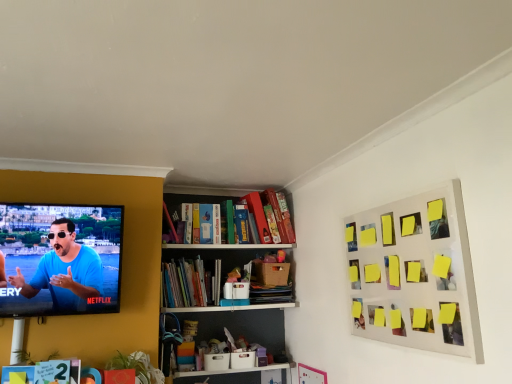
The height and width of the screenshot is (384, 512). Describe the element at coordinates (190, 283) in the screenshot. I see `hardcover books at center, which appears as the second book when viewed from the front` at that location.

What do you see at coordinates (47, 372) in the screenshot? I see `hardcover book at lower left, which ranks as the 2th book in right-to-left order` at bounding box center [47, 372].

The image size is (512, 384). In order to click on matte blue shirt at left in this screenshot , I will do `click(65, 270)`.

Find the location of a particular element. The height and width of the screenshot is (384, 512). picture frame above the hardcover books at center, which appears as the second book when viewed from the front (from the image's perspective) is located at coordinates (x=415, y=274).

How many degrees apart are the facing directions of yellow sticky notes at upper right and hardcover books at center, the second book in the left-to-right sequence?

The angular difference between yellow sticky notes at upper right and hardcover books at center, the second book in the left-to-right sequence, is 90 degrees.

Could you measure the distance between yellow sticky notes at upper right and hardcover books at center, the second book in the left-to-right sequence?

yellow sticky notes at upper right is 1.25 meters away from hardcover books at center, the second book in the left-to-right sequence.

Could you tell me if yellow sticky notes at upper right is turned towards hardcover books at center, which appears as the second book when viewed from the front?

No, yellow sticky notes at upper right does not turn towards hardcover books at center, which appears as the second book when viewed from the front.

Is point (209, 288) in front of point (401, 213)?

No, (209, 288) is behind (401, 213).

Considering the relative sizes of hardcover books at center, positioned as the first book in back-to-front order, and yellow sticky notes at upper right in the image provided, is hardcover books at center, positioned as the first book in back-to-front order, taller than yellow sticky notes at upper right?

No, hardcover books at center, positioned as the first book in back-to-front order, is not taller than yellow sticky notes at upper right.

From the image's perspective, is hardcover books at center, which is the first book from right to left, below yellow sticky notes at upper right?

Indeed, from the image's perspective, hardcover books at center, which is the first book from right to left, is shown beneath yellow sticky notes at upper right.

Is hardcover book at lower left, marked as the second book in a back-to-front arrangement, wider or thinner than matte blue shirt at left?

hardcover book at lower left, marked as the second book in a back-to-front arrangement, is thinner than matte blue shirt at left.

Are hardcover book at lower left, the first book in the front-to-back sequence, and matte blue shirt at left located far from each other?

Actually, hardcover book at lower left, the first book in the front-to-back sequence, and matte blue shirt at left are a little close together.

From the image's perspective, which one is positioned higher, hardcover book at lower left, the 2th book when ordered from top to bottom, or matte blue shirt at left?

matte blue shirt at left, from the image's perspective.

Where is `person above the hardcover book at lower left, which is the first book in bottom-to-top order (from a real-world perspective)`? person above the hardcover book at lower left, which is the first book in bottom-to-top order (from a real-world perspective) is located at coordinates (65, 270).

Does hardcover books at center, the second book in the left-to-right sequence, have a greater height compared to matte blue shirt at left?

No, hardcover books at center, the second book in the left-to-right sequence, is not taller than matte blue shirt at left.

Can you confirm if hardcover books at center, positioned as the first book in back-to-front order, is thinner than matte blue shirt at left?

In fact, hardcover books at center, positioned as the first book in back-to-front order, might be wider than matte blue shirt at left.

Between hardcover books at center, positioned as the 2th book in bottom-to-top order, and matte blue shirt at left, which one appears on the right side from the viewer's perspective?

From the viewer's perspective, hardcover books at center, positioned as the 2th book in bottom-to-top order, appears more on the right side.

Which is behind, hardcover books at center, positioned as the first book in back-to-front order, or matte blue shirt at left?

hardcover books at center, positioned as the first book in back-to-front order, is further away from the camera.

Would you say hardcover books at center, positioned as the first book in back-to-front order, is inside or outside hardcover book at lower left, which is the first book in bottom-to-top order?

hardcover books at center, positioned as the first book in back-to-front order, is not enclosed by hardcover book at lower left, which is the first book in bottom-to-top order.

From the image's perspective, between hardcover books at center, the 1th book in the top-to-bottom sequence, and hardcover book at lower left, which is the first book in bottom-to-top order, who is located below?

hardcover book at lower left, which is the first book in bottom-to-top order, appears lower in the image.

Is hardcover books at center, positioned as the first book in back-to-front order, far from hardcover book at lower left, which is the first book in bottom-to-top order?

Actually, hardcover books at center, positioned as the first book in back-to-front order, and hardcover book at lower left, which is the first book in bottom-to-top order, are a little close together.

Based on the photo, is hardcover books at center, which appears as the second book when viewed from the front, oriented away from hardcover book at lower left, marked as the second book in a back-to-front arrangement?

hardcover books at center, which appears as the second book when viewed from the front, is not turned away from hardcover book at lower left, marked as the second book in a back-to-front arrangement.

Identify the location of person above the yellow sticky notes at upper right (from the image's perspective). This screenshot has height=384, width=512. (65, 270).

Is matte blue shirt at left bigger than yellow sticky notes at upper right?

Indeed, matte blue shirt at left has a larger size compared to yellow sticky notes at upper right.

From the image's perspective, does matte blue shirt at left appear lower than yellow sticky notes at upper right?

No, from the image's perspective, matte blue shirt at left is not beneath yellow sticky notes at upper right.

Measure the distance from matte blue shirt at left to yellow sticky notes at upper right.

The distance of matte blue shirt at left from yellow sticky notes at upper right is 1.51 meters.

Which object is positioned more to the right, yellow sticky notes at upper right or matte blue shirt at left?

yellow sticky notes at upper right.

From the image's perspective, relative to matte blue shirt at left, is yellow sticky notes at upper right above or below?

yellow sticky notes at upper right is situated lower than matte blue shirt at left in the image.

The height and width of the screenshot is (384, 512). I want to click on the 1st book to the left of the yellow sticky notes at upper right, starting your count from the anchor, so coord(190,283).

Locate an element on the screen. This screenshot has width=512, height=384. picture frame in front of the hardcover books at center, positioned as the first book in back-to-front order is located at coordinates (415, 274).

Estimate the real-world distances between objects in this image. Which object is closer to yellow sticky notes at upper right, matte blue shirt at left or hardcover books at center, which appears as the second book when viewed from the front?

hardcover books at center, which appears as the second book when viewed from the front, lies closer to yellow sticky notes at upper right than the other object.

Estimate the real-world distances between objects in this image. Which object is further from yellow sticky notes at upper right, hardcover book at lower left, the 2th book when ordered from top to bottom, or hardcover books at center, positioned as the 2th book in bottom-to-top order?

The object further to yellow sticky notes at upper right is hardcover book at lower left, the 2th book when ordered from top to bottom.

In the scene shown: When comparing their distances from matte blue shirt at left, does yellow sticky notes at upper right or hardcover books at center, which appears as the second book when viewed from the front, seem closer?

Among the two, hardcover books at center, which appears as the second book when viewed from the front, is located nearer to matte blue shirt at left.

Estimate the real-world distances between objects in this image. Which object is closer to hardcover book at lower left, which is the first book in bottom-to-top order, yellow sticky notes at upper right or hardcover books at center, positioned as the 2th book in bottom-to-top order?

Among the two, hardcover books at center, positioned as the 2th book in bottom-to-top order, is located nearer to hardcover book at lower left, which is the first book in bottom-to-top order.

From the image, which object appears to be farther from yellow sticky notes at upper right, hardcover books at center, which is the first book from right to left, or hardcover book at lower left, acting as the 1th book starting from the left?

hardcover book at lower left, acting as the 1th book starting from the left, is positioned further to the anchor yellow sticky notes at upper right.

Estimate the real-world distances between objects in this image. Which object is further from hardcover book at lower left, which is the first book in bottom-to-top order, hardcover books at center, positioned as the first book in back-to-front order, or matte blue shirt at left?

hardcover books at center, positioned as the first book in back-to-front order, is further to hardcover book at lower left, which is the first book in bottom-to-top order.

Which object lies nearer to the anchor point yellow sticky notes at upper right, hardcover book at lower left, the 2th book when ordered from top to bottom, or matte blue shirt at left?

matte blue shirt at left.

When comparing their distances from yellow sticky notes at upper right, does hardcover books at center, positioned as the 2th book in bottom-to-top order, or matte blue shirt at left seem closer?

The object closer to yellow sticky notes at upper right is hardcover books at center, positioned as the 2th book in bottom-to-top order.

Locate an element on the screen. This screenshot has width=512, height=384. book between hardcover book at lower left, which is the first book in bottom-to-top order, and yellow sticky notes at upper right from left to right is located at coordinates (190, 283).

Identify the location of person between hardcover book at lower left, acting as the 1th book starting from the left, and hardcover books at center, which is the first book from right to left, in the front-back direction. The image size is (512, 384). (65, 270).

Where is `book between matte blue shirt at left and yellow sticky notes at upper right in the horizontal direction`? The image size is (512, 384). book between matte blue shirt at left and yellow sticky notes at upper right in the horizontal direction is located at coordinates (190, 283).

Identify the location of person situated between hardcover book at lower left, which is the first book in bottom-to-top order, and yellow sticky notes at upper right from left to right. This screenshot has height=384, width=512. (65, 270).